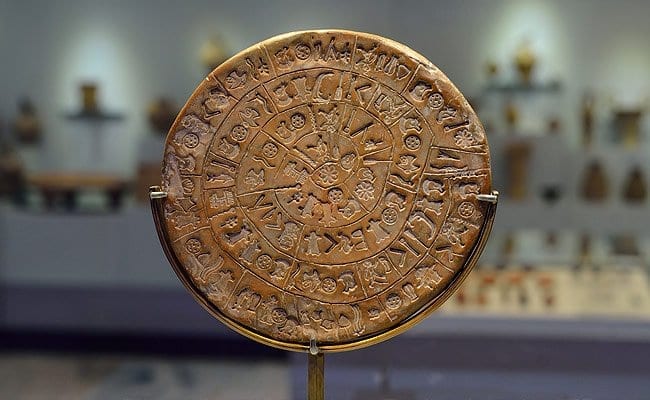
Identify the location of lighted area. (95, 53), (521, 21).